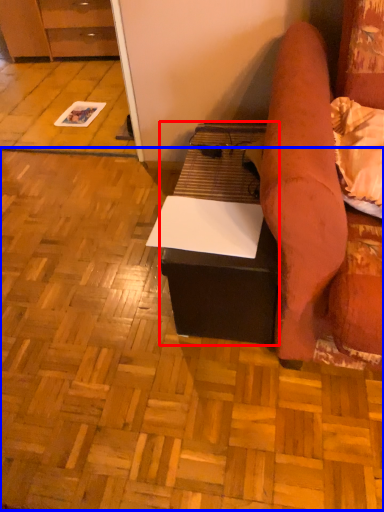
Question: Among these objects, which one is nearest to the camera, table (highlighted by a red box) or plywood (highlighted by a blue box)?

Choices:
 (A) table
 (B) plywood

Answer: (B)